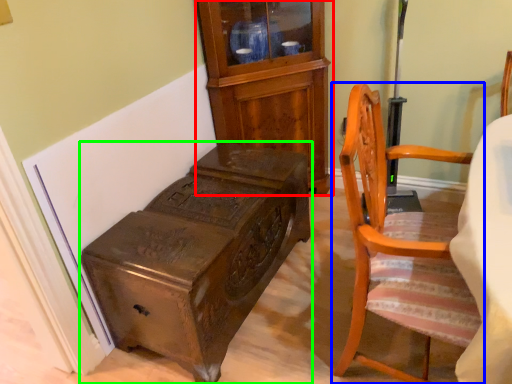
Question: Considering the real-world distances, which object is closest to cabinetry (highlighted by a red box)? chair (highlighted by a blue box) or furniture (highlighted by a green box).

Choices:
 (A) chair
 (B) furniture

Answer: (B)